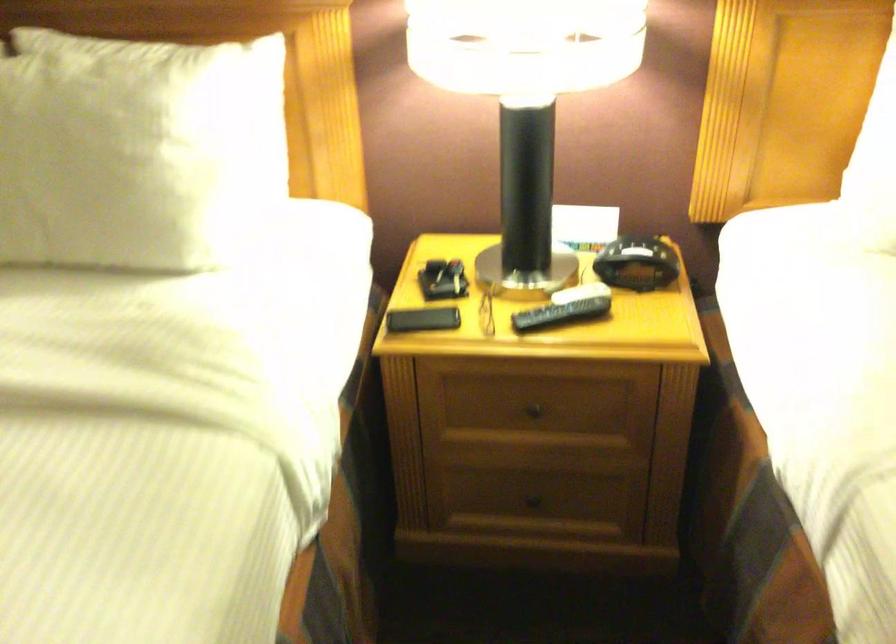
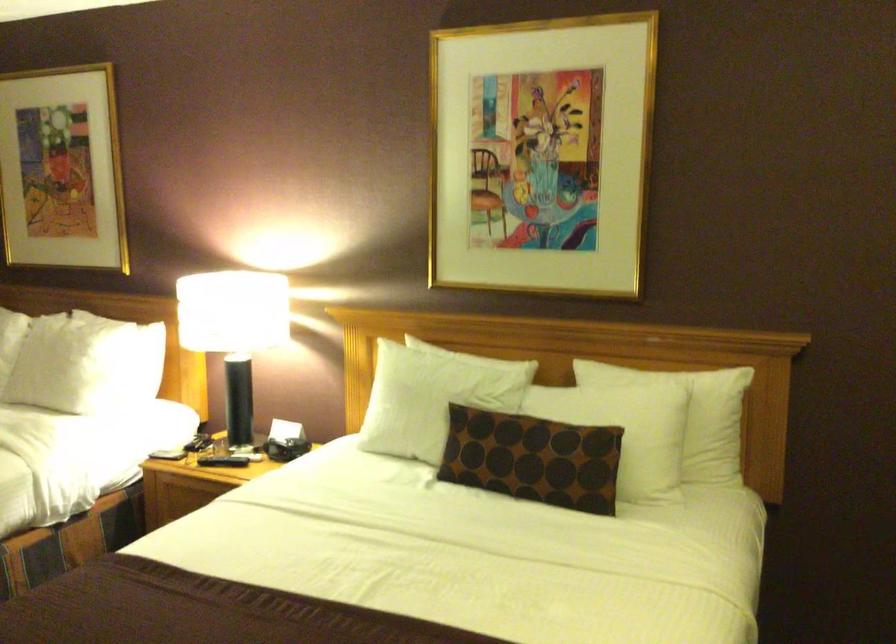
Where in the second image is the point corresponding to (159,169) from the first image?

(73, 364)